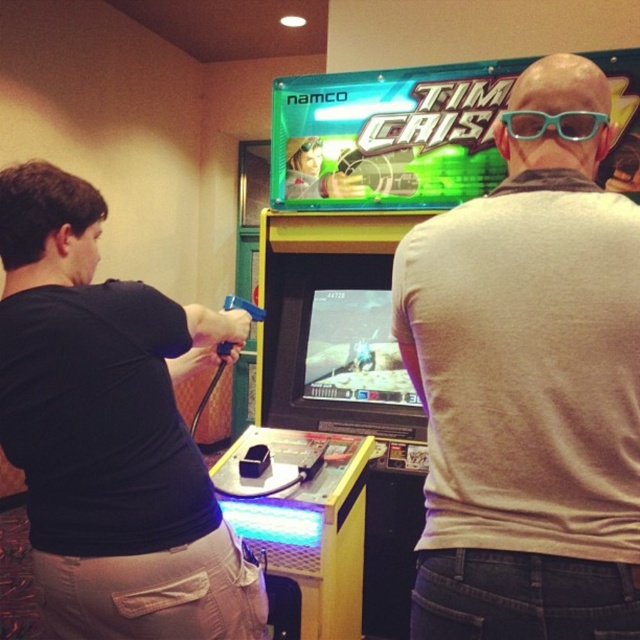
Can you confirm if gray matte shirt at center is smaller than teal plastic glasses at upper center?

Incorrect, gray matte shirt at center is not smaller in size than teal plastic glasses at upper center.

Does gray matte shirt at center have a greater height compared to teal plastic glasses at upper center?

Yes, gray matte shirt at center is taller than teal plastic glasses at upper center.

Which is in front, point (596, 339) or point (593, 118)?

Positioned in front is point (596, 339).

Where is `gray matte shirt at center`? gray matte shirt at center is located at coordinates (528, 401).